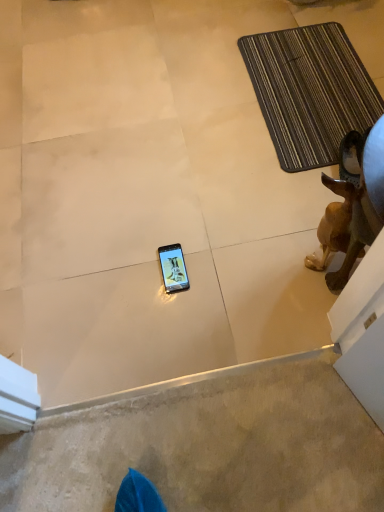
The height and width of the screenshot is (512, 384). Identify the location of vacant space behind brown matte dog at right. (292, 216).